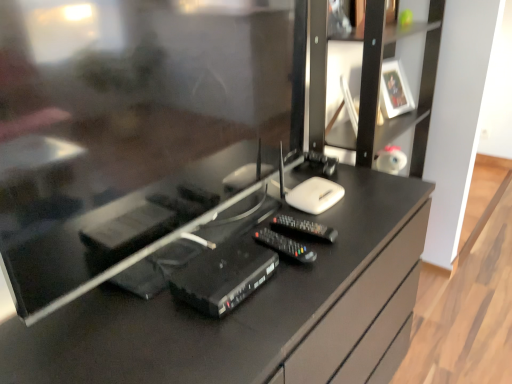
You are a GUI agent. You are given a task and a screenshot of the screen. Output one action in this format:
    pyautogui.click(x=<x>, y=<y>)
    Task: Click on the vacant space situated on the left part of black plastic router at center, placed as the first equipment when sorted from left to right
    Image resolution: width=512 pixels, height=384 pixels.
    Given the screenshot: What is the action you would take?
    pyautogui.click(x=130, y=317)